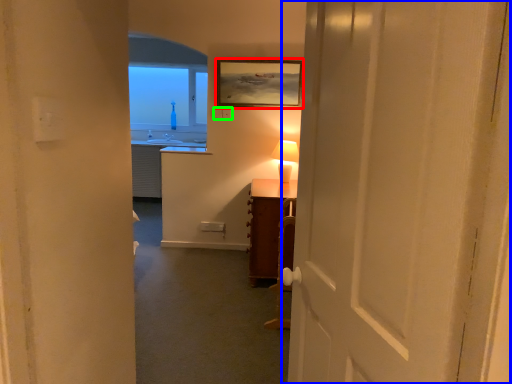
Question: Considering the real-world distances, which object is closest to picture frame (highlighted by a red box)? door (highlighted by a blue box) or electric outlet (highlighted by a green box).

Choices:
 (A) door
 (B) electric outlet

Answer: (B)